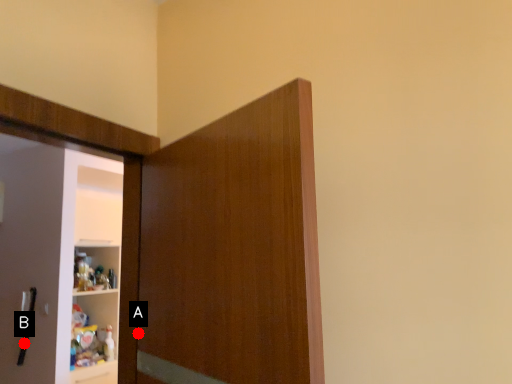
Question: Two points are circled on the image, labeled by A and B beside each circle. Which point is closer to the camera taking this photo?

Choices:
 (A) A is closer
 (B) B is closer

Answer: (A)